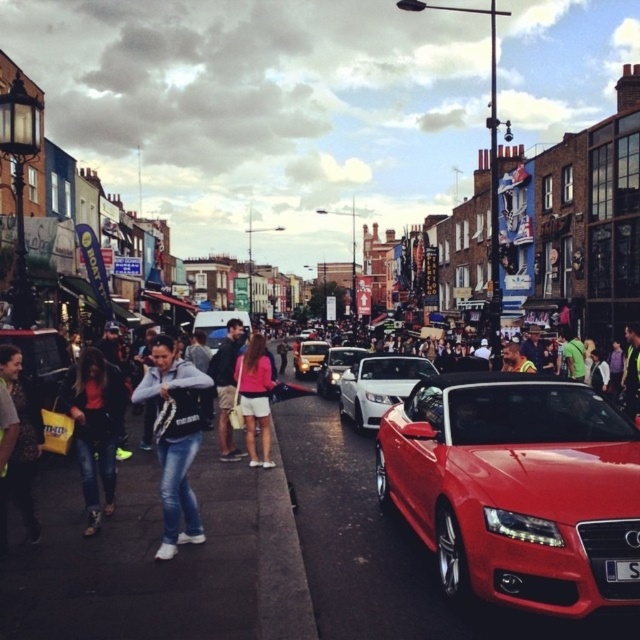
You are a delivery person who needs to place a large package on the sidewalk between the dark blue jeans at center and the shiny silver car at center. Which object should you place the package closer to to ensure it doesn

The dark blue jeans at center is bigger than the shiny silver car at center, so placing the package closer to the shiny silver car at center would leave more space for the larger dark blue jeans at center.

You are standing at point (620, 563) and want to walk to point (225, 419). Is the destination point in front of or behind you?

The destination point (225, 419) is behind point (620, 563), so it is behind you.

You are a street vendor standing on the sidewalk. You see a denim jacket at center and a matte black crowd at center. Which object is closer to the left side of the street?

The denim jacket at center is closer to the left side of the street because it is positioned to the left of the matte black crowd at center.